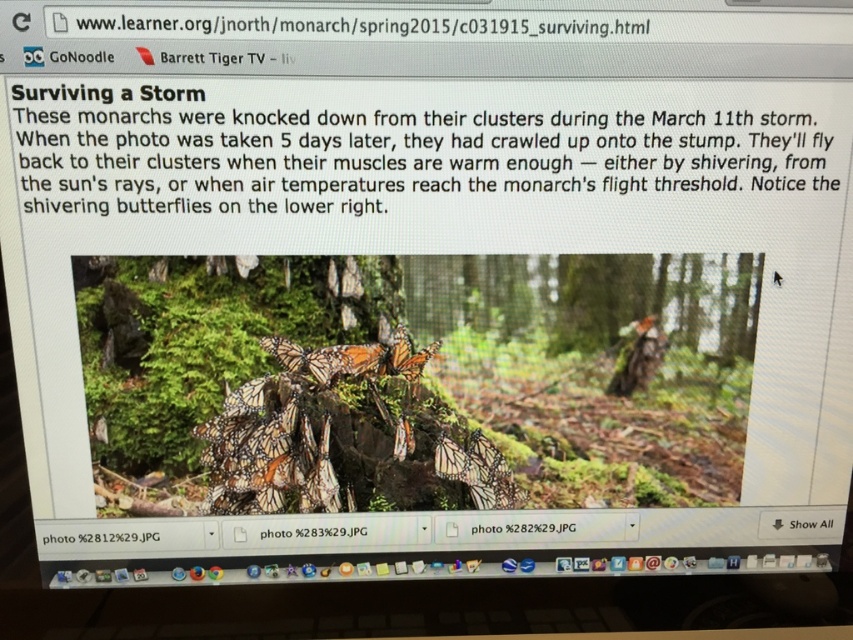
Where is `matte orange butterfly at center`? The height and width of the screenshot is (640, 853). matte orange butterfly at center is located at coordinates (312, 531).

Does matte orange butterfly at center have a lesser width compared to translucent orange wings at center?

In fact, matte orange butterfly at center might be wider than translucent orange wings at center.

You are a GUI agent. You are given a task and a screenshot of the screen. Output one action in this format:
    pyautogui.click(x=<x>, y=<y>)
    Task: Click on the matte orange butterfly at center
    
    Given the screenshot: What is the action you would take?
    pyautogui.click(x=312, y=531)